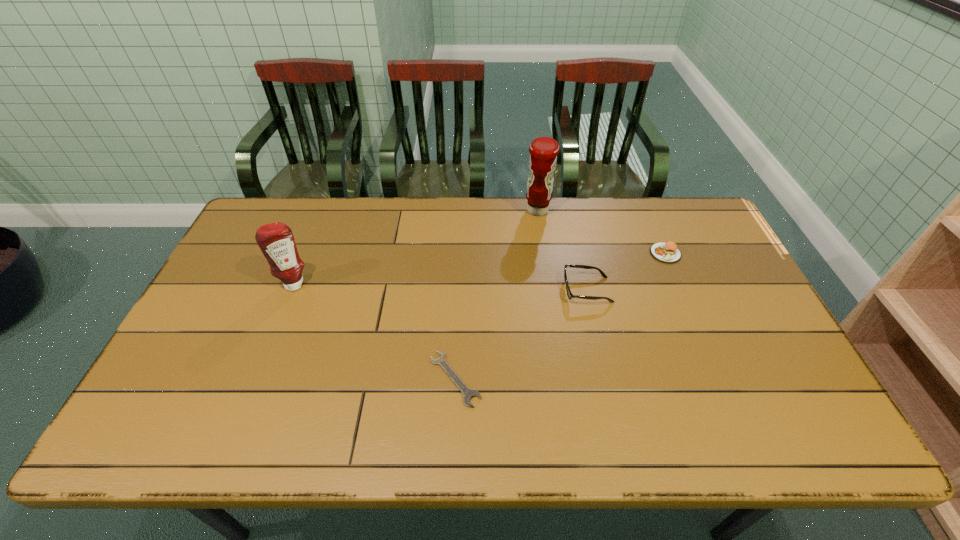
You are a GUI agent. You are given a task and a screenshot of the screen. Output one action in this format:
    pyautogui.click(x=<x>, y=<y>)
    Task: Click on the vacant space situated 0.260m on the back of the leftmost object
    The image size is (960, 540).
    Given the screenshot: What is the action you would take?
    pyautogui.click(x=319, y=222)

Locate an element on the screen. This screenshot has width=960, height=540. blank space located 0.330m on the lenses of the third tallest object is located at coordinates (452, 290).

Identify the location of vacant space positioned on the lenses of the third tallest object. (472, 290).

You are a GUI agent. You are given a task and a screenshot of the screen. Output one action in this format:
    pyautogui.click(x=<x>, y=<y>)
    Task: Click on the free location located 0.050m on the lenses of the third tallest object
    
    Given the screenshot: What is the action you would take?
    pyautogui.click(x=546, y=290)

I want to click on vacant space located on the left of the patty, so pos(622,253).

Locate an element on the screen. free space located on the left of the nearest object is located at coordinates (404, 379).

What are the coordinates of `object present at the far edge` in the screenshot? It's located at coord(543,151).

The image size is (960, 540). Identify the location of object that is at the right edge. (668, 252).

Where is `vacant area at the far edge of the desktop`? The width and height of the screenshot is (960, 540). vacant area at the far edge of the desktop is located at coordinates (388, 218).

Identify the location of blank space at the near edge of the desktop. The image size is (960, 540). (602, 447).